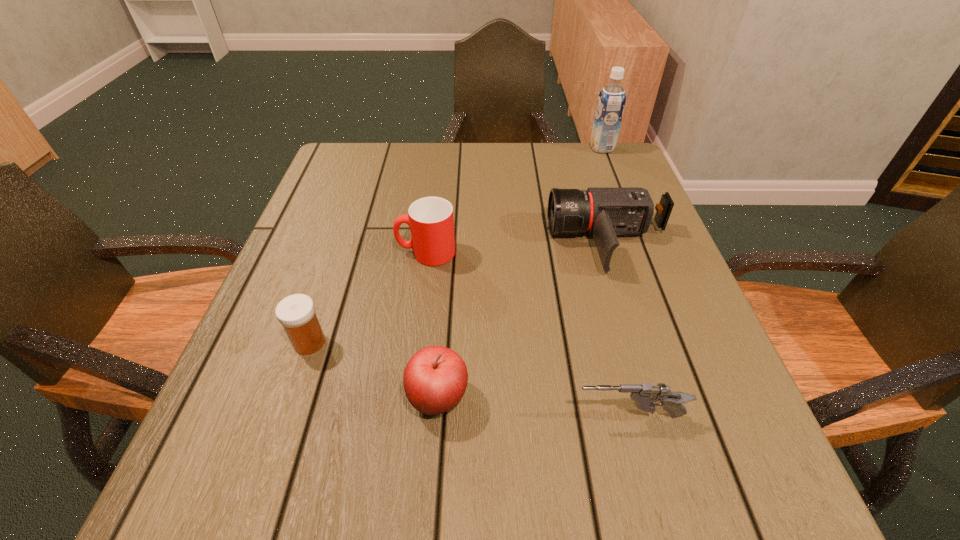
Locate an element on the screen. The width and height of the screenshot is (960, 540). the farthest object is located at coordinates (611, 102).

What are the coordinates of `the tallest object` in the screenshot? It's located at (611, 102).

At what (x,y) coordinates should I click in order to perform the action: click on cup. Please return your answer as a coordinate pair (x, y). This screenshot has width=960, height=540. Looking at the image, I should click on (430, 219).

At what (x,y) coordinates should I click in order to perform the action: click on camcorder. Please return your answer as a coordinate pair (x, y). Looking at the image, I should click on (602, 212).

I want to click on apple, so click(435, 379).

Locate an element on the screen. the leftmost object is located at coordinates (296, 312).

Identify the location of medicine. (296, 312).

Find the location of a particular element. gun is located at coordinates (644, 394).

Where is `free space located 0.180m on the label of the tallest object`? The image size is (960, 540). free space located 0.180m on the label of the tallest object is located at coordinates (526, 148).

Where is `free space located on the label of the tallest object`? The height and width of the screenshot is (540, 960). free space located on the label of the tallest object is located at coordinates (572, 148).